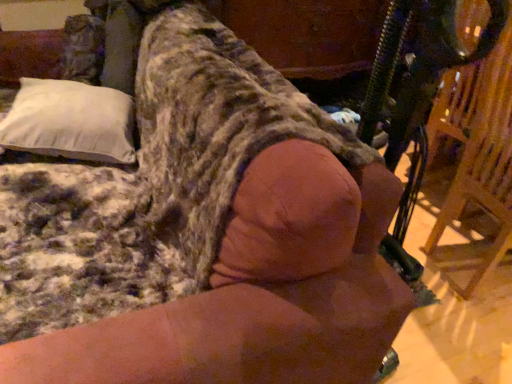
Question: Would you say wooden swivel chair at right is outside white soft pillow at upper left?

Choices:
 (A) no
 (B) yes

Answer: (B)

Question: Is wooden swivel chair at right aimed at white soft pillow at upper left?

Choices:
 (A) no
 (B) yes

Answer: (A)

Question: Is wooden swivel chair at right next to white soft pillow at upper left and touching it?

Choices:
 (A) no
 (B) yes

Answer: (A)

Question: From the image's perspective, is wooden swivel chair at right located beneath white soft pillow at upper left?

Choices:
 (A) yes
 (B) no

Answer: (A)

Question: Is wooden swivel chair at right smaller than white soft pillow at upper left?

Choices:
 (A) no
 (B) yes

Answer: (A)

Question: Considering the relative sizes of wooden swivel chair at right and white soft pillow at upper left in the image provided, is wooden swivel chair at right taller than white soft pillow at upper left?

Choices:
 (A) yes
 (B) no

Answer: (A)

Question: From a real-world perspective, is white soft pillow at upper left located beneath wooden swivel chair at right?

Choices:
 (A) yes
 (B) no

Answer: (B)

Question: Is wooden swivel chair at right a part of white soft pillow at upper left?

Choices:
 (A) no
 (B) yes

Answer: (A)

Question: Can you confirm if white soft pillow at upper left is bigger than wooden swivel chair at right?

Choices:
 (A) yes
 (B) no

Answer: (B)

Question: From the image's perspective, is white soft pillow at upper left located beneath wooden swivel chair at right?

Choices:
 (A) no
 (B) yes

Answer: (A)

Question: Is white soft pillow at upper left beside wooden swivel chair at right?

Choices:
 (A) no
 (B) yes

Answer: (A)

Question: Can you confirm if white soft pillow at upper left is shorter than wooden swivel chair at right?

Choices:
 (A) no
 (B) yes

Answer: (B)

Question: Considering the relative positions of wooden swivel chair at right and white soft pillow at upper left in the image provided, is wooden swivel chair at right to the left or to the right of white soft pillow at upper left?

Choices:
 (A) left
 (B) right

Answer: (B)